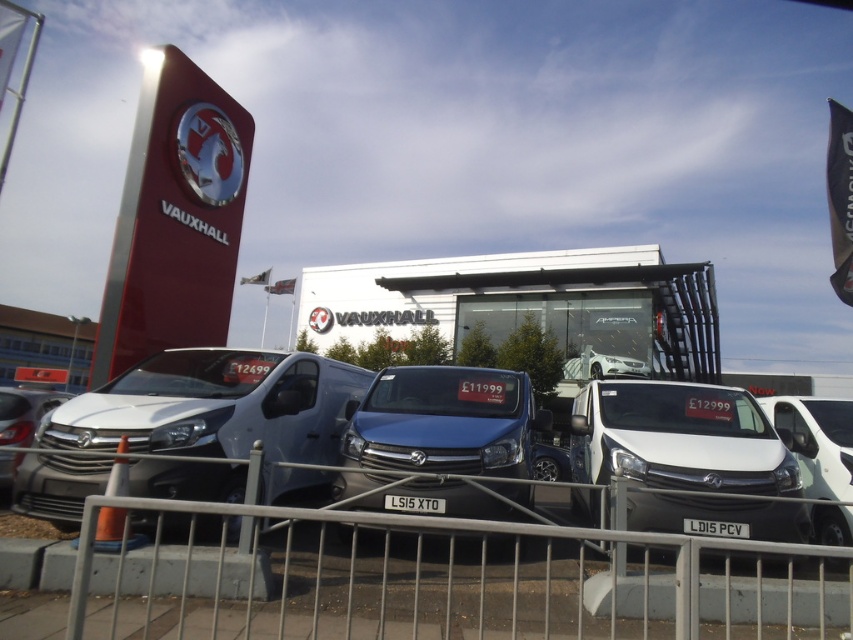
Between point (752, 476) and point (7, 432), which one is positioned in front?

Point (752, 476)

Between white glossy van at center and matte silver van at center, which one is positioned lower?

matte silver van at center

Which is in front, point (610, 424) or point (51, 388)?

Positioned in front is point (610, 424).

You are a GUI agent. You are given a task and a screenshot of the screen. Output one action in this format:
    pyautogui.click(x=<x>, y=<y>)
    Task: Click on the white glossy van at center
    
    Given the screenshot: What is the action you would take?
    click(x=688, y=458)

Does point (256, 611) come farther from viewer compared to point (753, 476)?

That is False.

Can you confirm if metallic gray fence at center is wider than white glossy van at center?

Yes.

Identify the location of metallic gray fence at center. (450, 579).

Is the position of white matte van at center less distant than that of matte silver van at center?

Yes, it is in front of matte silver van at center.

Which is above, white matte van at center or matte silver van at center?

white matte van at center

Who is more forward, (x=828, y=435) or (x=10, y=420)?

Point (x=828, y=435) is more forward.

Locate an element on the screen. Image resolution: width=853 pixels, height=640 pixels. white matte van at center is located at coordinates (816, 442).